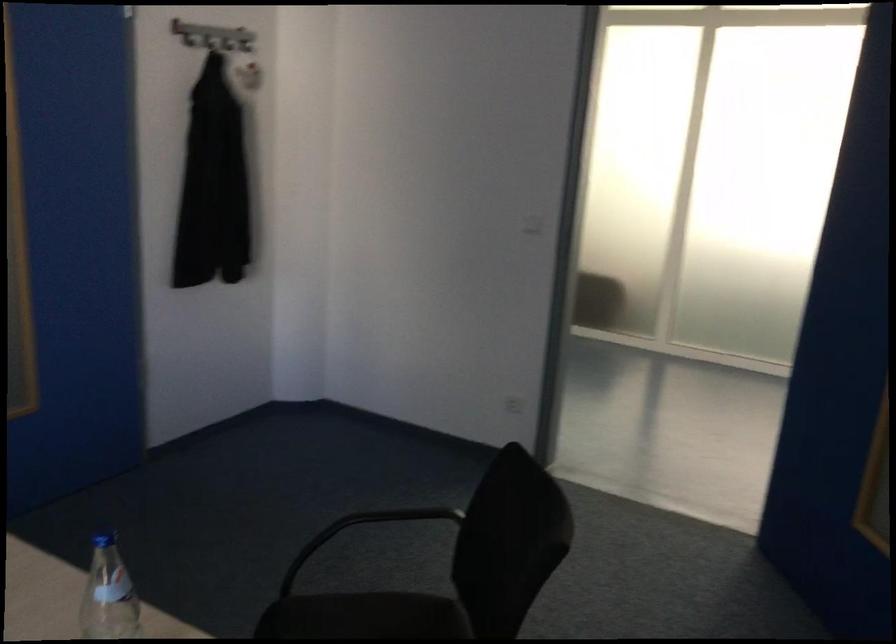
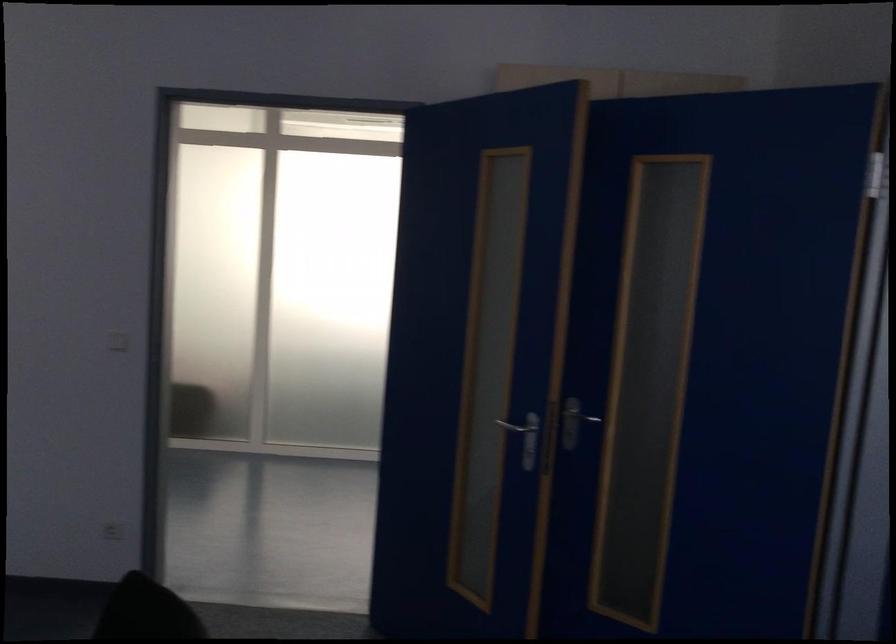
Question: Which direction would the cameraman need to move to produce the second image? Reply with the corresponding letter.

Choices:
 (A) Left
 (B) Right
 (C) Forward
 (D) Backward

Answer: (D)